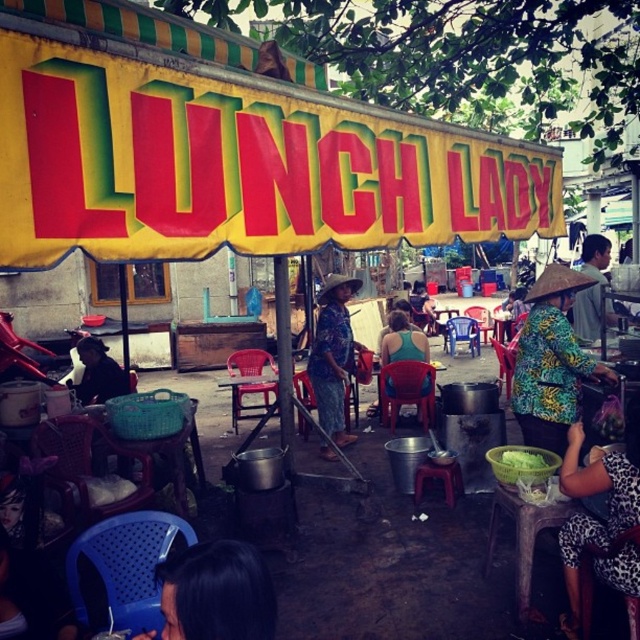
Question: Which of the following is the farthest from the observer?

Choices:
 (A) (524, 420)
 (B) (397, 321)
 (C) (595, 538)
 (D) (541, 467)

Answer: (B)

Question: Considering the relative positions of batik-patterned fabric at center and green leafy vegetable at center in the image provided, where is batik-patterned fabric at center located with respect to green leafy vegetable at center?

Choices:
 (A) right
 (B) left

Answer: (A)

Question: Which point is farther from the camera taking this photo?

Choices:
 (A) (504, 452)
 (B) (320, 300)
 (C) (390, 320)
 (D) (576, 589)

Answer: (C)

Question: Is batik-patterned fabric at center thinner than printed fabric skirt at center?

Choices:
 (A) yes
 (B) no

Answer: (B)

Question: Is printed fabric skirt at center below green leafy vegetable at center?

Choices:
 (A) no
 (B) yes

Answer: (A)

Question: Which object appears farthest from the camera in this image?

Choices:
 (A) batik-patterned fabric at center
 (B) printed fabric skirt at center
 (C) green fabric shirt at center
 (D) wooden table at lower right

Answer: (C)